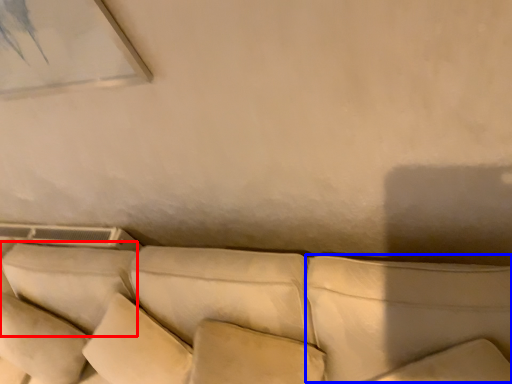
Question: Which of the following is the closest to the observer, pillow (highlighted by a red box) or pillow (highlighted by a blue box)?

Choices:
 (A) pillow
 (B) pillow

Answer: (B)